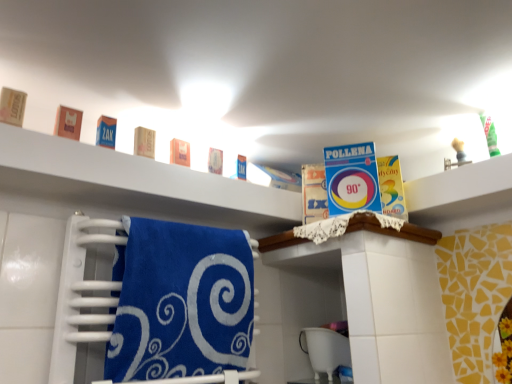
The image size is (512, 384). What do you see at coordinates (351, 178) in the screenshot?
I see `blue cardboard box at upper center, which is counted as the sixth product, starting from the left` at bounding box center [351, 178].

In order to face matte brown soap at upper center, the 4th product when ordered from left to right, should I rotate leftwards or rightwards?

A 14.689 degree turn to the left will do.

This screenshot has height=384, width=512. What are the coordinates of `satin blue towel at lower left` in the screenshot? It's located at (180, 301).

The width and height of the screenshot is (512, 384). Identify the location of matte brown soap at left, the 7th product from the right. (12, 106).

How much space does matte orange soap at center, arranged as the 5th product when viewed from the left, occupy vertically?

It is 3.57 inches.

Locate an element on the screen. The width and height of the screenshot is (512, 384). blue cardboard box at upper center, which is counted as the sixth product, starting from the left is located at coordinates (351, 178).

Consider the image. Is orange matte box at upper left, which is the 2th product in left-to-right order, behind yellow cardboard box at upper right, marked as the seventh product in a left-to-right arrangement?

That is False.

Is orange matte box at upper left, which is the 2th product in left-to-right order, next to yellow cardboard box at upper right, which appears as the first product when viewed from the right, and touching it?

orange matte box at upper left, which is the 2th product in left-to-right order, is not next to yellow cardboard box at upper right, which appears as the first product when viewed from the right, and they're not touching.

Based on the photo, in the image, is orange matte box at upper left, arranged as the 6th product when viewed from the right, on the left side or the right side of yellow cardboard box at upper right, marked as the seventh product in a left-to-right arrangement?

orange matte box at upper left, arranged as the 6th product when viewed from the right, is to the left of yellow cardboard box at upper right, marked as the seventh product in a left-to-right arrangement.

Is orange matte box at upper left, arranged as the 6th product when viewed from the right, smaller than yellow cardboard box at upper right, which appears as the first product when viewed from the right?

Indeed, orange matte box at upper left, arranged as the 6th product when viewed from the right, has a smaller size compared to yellow cardboard box at upper right, which appears as the first product when viewed from the right.

In terms of width, does white plastic bucket at lower center look wider or thinner when compared to matte brown soap at left, the first product when ordered from left to right?

Considering their sizes, white plastic bucket at lower center looks broader than matte brown soap at left, the first product when ordered from left to right.

Which of these two, white plastic bucket at lower center or matte brown soap at left, the 7th product from the right, stands taller?

white plastic bucket at lower center is taller.

Does point (322, 354) lie in front of point (20, 118)?

No, (322, 354) is further to viewer.

Is matte brown soap at upper center, the 4th product when ordered from left to right, turned away from blue cardboard box at upper left, the fifth product in the right-to-left sequence?

No, blue cardboard box at upper left, the fifth product in the right-to-left sequence, is not at the back of matte brown soap at upper center, the 4th product when ordered from left to right.

Are matte brown soap at upper center, the 4th product when ordered from left to right, and blue cardboard box at upper left, the fifth product in the right-to-left sequence, making contact?

Yes, matte brown soap at upper center, the 4th product when ordered from left to right, is touching blue cardboard box at upper left, the fifth product in the right-to-left sequence.

Based on the photo, which of these two, matte brown soap at upper center, the 4th product when ordered from left to right, or blue cardboard box at upper left, which is the third product from left to right, is wider?

matte brown soap at upper center, the 4th product when ordered from left to right.

From the image's perspective, relative to blue cardboard box at upper left, which is the third product from left to right, is matte brown soap at upper center, the fourth product in the right-to-left sequence, above or below?

Based on their image positions, matte brown soap at upper center, the fourth product in the right-to-left sequence, is located beneath blue cardboard box at upper left, which is the third product from left to right.

Considering the sizes of objects matte orange soap at center, arranged as the 5th product when viewed from the left, and orange matte box at upper left, which is the 2th product in left-to-right order, in the image provided, who is wider, matte orange soap at center, arranged as the 5th product when viewed from the left, or orange matte box at upper left, which is the 2th product in left-to-right order,?

With larger width is matte orange soap at center, arranged as the 5th product when viewed from the left.

Considering the points (184, 141) and (64, 111), which point is in front, point (184, 141) or point (64, 111)?

The point (64, 111) is more forward.

Is the depth of matte orange soap at center, the 3th product from the right, less than that of orange matte box at upper left, arranged as the 6th product when viewed from the right?

No, it is not.

Is matte orange soap at center, the 3th product from the right, oriented towards orange matte box at upper left, arranged as the 6th product when viewed from the right?

No.

Could you tell me if matte orange soap at center, the 3th product from the right, is facing satin blue towel at lower left?

No, matte orange soap at center, the 3th product from the right, is not facing towards satin blue towel at lower left.

Is matte orange soap at center, the 3th product from the right, next to satin blue towel at lower left?

No, matte orange soap at center, the 3th product from the right, is not touching satin blue towel at lower left.

Who is taller, matte orange soap at center, arranged as the 5th product when viewed from the left, or satin blue towel at lower left?

With more height is satin blue towel at lower left.

From a real-world perspective, does matte orange soap at center, the 3th product from the right, sit lower than satin blue towel at lower left?

No, from a real-world perspective, matte orange soap at center, the 3th product from the right, is not under satin blue towel at lower left.

The height and width of the screenshot is (384, 512). I want to click on the 3rd product to the left when counting from the white matte shelf at upper center, which ranks as the first shelf in left-to-right order, so click(68, 123).

How far apart are orange matte box at upper left, which is the 2th product in left-to-right order, and white matte shelf at upper center, which ranks as the first shelf in left-to-right order?

9.81 inches.

Is point (74, 118) behind point (46, 149)?

Yes.

Is satin blue towel at lower left completely or partially outside of wooden at upper center, acting as the second shelf starting from the left?

That's correct, satin blue towel at lower left is outside of wooden at upper center, acting as the second shelf starting from the left.

Can you confirm if satin blue towel at lower left is shorter than wooden at upper center, which is the first shelf from right to left?

In fact, satin blue towel at lower left may be taller than wooden at upper center, which is the first shelf from right to left.

Is satin blue towel at lower left next to wooden at upper center, acting as the second shelf starting from the left, and touching it?

satin blue towel at lower left and wooden at upper center, acting as the second shelf starting from the left, are clearly separated.

Looking at this image, does satin blue towel at lower left have a smaller size compared to wooden at upper center, acting as the second shelf starting from the left?

No, satin blue towel at lower left is not smaller than wooden at upper center, acting as the second shelf starting from the left.

The image size is (512, 384). In order to click on product that is the 2nd one above the yellow cardboard box at upper right, which appears as the first product when viewed from the right (from a real-world perspective) in this screenshot , I will do `click(68, 123)`.

Identify the location of the 5th product to the left of the white plastic bucket at lower center, counting from the anchor's position. (12, 106).

Looking at the image, which one is located further to satin blue towel at lower left, wooden at upper center, acting as the second shelf starting from the left, or matte brown soap at upper center, the fourth product in the right-to-left sequence?

Among the two, wooden at upper center, acting as the second shelf starting from the left, is located further to satin blue towel at lower left.

Considering their positions, is white plastic bucket at lower center positioned closer to matte brown soap at upper center, the 4th product when ordered from left to right, than blue cardboard box at upper left, which is the third product from left to right?

blue cardboard box at upper left, which is the third product from left to right.

Based on their spatial positions, is matte brown soap at left, the first product when ordered from left to right, or yellow cardboard box at upper right, which appears as the first product when viewed from the right, further from white plastic bucket at lower center?

matte brown soap at left, the first product when ordered from left to right, is positioned further to the anchor white plastic bucket at lower center.

Estimate the real-world distances between objects in this image. Which object is closer to matte brown soap at left, the 7th product from the right, satin blue towel at lower left or matte orange soap at center, the 3th product from the right?

matte orange soap at center, the 3th product from the right, is positioned closer to the anchor matte brown soap at left, the 7th product from the right.

When comparing their distances from blue cardboard box at upper center, placed as the second product when sorted from right to left, does white plastic bucket at lower center or wooden at upper center, which is the first shelf from right to left, seem closer?

Among the two, wooden at upper center, which is the first shelf from right to left, is located nearer to blue cardboard box at upper center, placed as the second product when sorted from right to left.

From the image, which object appears to be nearer to wooden at upper center, acting as the second shelf starting from the left, orange matte box at upper left, which is the 2th product in left-to-right order, or yellow cardboard box at upper right, marked as the seventh product in a left-to-right arrangement?

yellow cardboard box at upper right, marked as the seventh product in a left-to-right arrangement, is positioned closer to the anchor wooden at upper center, acting as the second shelf starting from the left.

Estimate the real-world distances between objects in this image. Which object is closer to orange matte box at upper left, which is the 2th product in left-to-right order, blue cardboard box at upper left, which is the third product from left to right, or satin blue towel at lower left?

blue cardboard box at upper left, which is the third product from left to right, is closer to orange matte box at upper left, which is the 2th product in left-to-right order.

Considering their positions, is blue cardboard box at upper left, the fifth product in the right-to-left sequence, positioned closer to yellow cardboard box at upper right, marked as the seventh product in a left-to-right arrangement, than matte brown soap at upper center, the fourth product in the right-to-left sequence?

matte brown soap at upper center, the fourth product in the right-to-left sequence, lies closer to yellow cardboard box at upper right, marked as the seventh product in a left-to-right arrangement, than the other object.

You are a GUI agent. You are given a task and a screenshot of the screen. Output one action in this format:
    pyautogui.click(x=<x>, y=<y>)
    Task: Click on the beach towel that lies between blue cardboard box at upper left, which is the third product from left to right, and white plastic bucket at lower center from top to bottom
    Image resolution: width=512 pixels, height=384 pixels.
    Given the screenshot: What is the action you would take?
    pyautogui.click(x=180, y=301)

Where is `shelf between orange matte box at upper left, arranged as the 6th product when viewed from the right, and blue cardboard box at upper center, which is counted as the sixth product, starting from the left`? Image resolution: width=512 pixels, height=384 pixels. shelf between orange matte box at upper left, arranged as the 6th product when viewed from the right, and blue cardboard box at upper center, which is counted as the sixth product, starting from the left is located at coordinates (135, 183).

Identify the location of sink between blue cardboard box at upper left, which is the third product from left to right, and blue cardboard box at upper center, placed as the second product when sorted from right to left, in the horizontal direction. (325, 350).

This screenshot has width=512, height=384. In order to click on beach towel between blue cardboard box at upper left, the fifth product in the right-to-left sequence, and wooden at upper center, which is the first shelf from right to left, in the horizontal direction in this screenshot , I will do click(x=180, y=301).